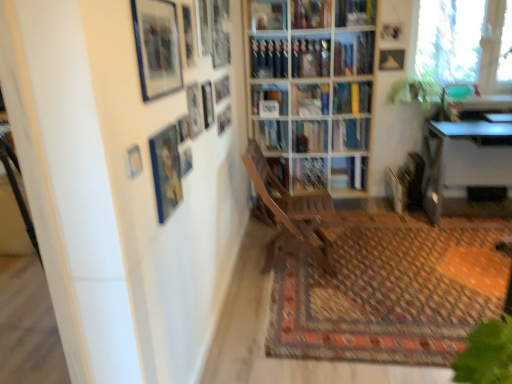
The image size is (512, 384). Describe the element at coordinates (184, 128) in the screenshot. I see `matte black picture frame at upper center, placed as the fourth picture frame when sorted from left to right` at that location.

The height and width of the screenshot is (384, 512). Describe the element at coordinates (204, 26) in the screenshot. I see `matte black picture frame at upper center, arranged as the fourth picture frame when viewed from the right` at that location.

The width and height of the screenshot is (512, 384). What do you see at coordinates (311, 92) in the screenshot? I see `wooden bookcase at center` at bounding box center [311, 92].

The height and width of the screenshot is (384, 512). Describe the element at coordinates (207, 104) in the screenshot. I see `metallic silver picture frame at upper center, which appears as the 3th picture frame when viewed from the right` at that location.

Identify the location of metallic silver picture frame at upper center, positioned as the ninth picture frame in front-to-back order. The image size is (512, 384). (207, 104).

This screenshot has height=384, width=512. Describe the element at coordinates (390, 290) in the screenshot. I see `patterned carpet at center` at that location.

Image resolution: width=512 pixels, height=384 pixels. Find the location of `matte black picture frame at upper right, the 11th picture frame from the front`. matte black picture frame at upper right, the 11th picture frame from the front is located at coordinates (391, 60).

Where is `matte black picture frame at upper center, which is the 6th picture frame in left-to-right order`? The height and width of the screenshot is (384, 512). matte black picture frame at upper center, which is the 6th picture frame in left-to-right order is located at coordinates (188, 35).

The image size is (512, 384). What do you see at coordinates (188, 35) in the screenshot?
I see `matte black picture frame at upper center, the 6th picture frame positioned from the right` at bounding box center [188, 35].

Locate an element on the screen. Image resolution: width=512 pixels, height=384 pixels. transparent glass window at upper right is located at coordinates (462, 42).

Based on the photo, considering the positions of objects transparent glass window at upper right and hardcover book at upper center, the 1th book viewed from the top, in the image provided, who is more to the right, transparent glass window at upper right or hardcover book at upper center, the 1th book viewed from the top,?

transparent glass window at upper right is more to the right.

Who is smaller, transparent glass window at upper right or hardcover book at upper center, the 1th book viewed from the top?

hardcover book at upper center, the 1th book viewed from the top, is smaller.

How much distance is there between transparent glass window at upper right and hardcover book at upper center, the 1th book viewed from the top?

The distance of transparent glass window at upper right from hardcover book at upper center, the 1th book viewed from the top, is 29.51 inches.

Are transparent glass window at upper right and hardcover book at upper center, the 1th book viewed from the top, located far from each other?

That's not correct — transparent glass window at upper right is a little close to hardcover book at upper center, the 1th book viewed from the top.

Does matte black picture frame at upper center, the 4th picture frame in the back-to-front sequence, appear on the left side of patterned carpet at center?

Correct, you'll find matte black picture frame at upper center, the 4th picture frame in the back-to-front sequence, to the left of patterned carpet at center.

Is matte black picture frame at upper center, arranged as the fourth picture frame when viewed from the right, spatially inside patterned carpet at center, or outside of it?

The correct answer is: outside.

In order to click on picture frame that is the 3rd object to the left of the patterned carpet at center, starting at the anchor in this screenshot , I will do `click(204, 26)`.

From the image's perspective, is matte black picture frame at upper center, the eighth picture frame from the front, on patterned carpet at center?

Yes.

Are matte black picture frame at upper center, arranged as the fifth picture frame when viewed from the back, and blue glossy picture frame at upper left, the second picture frame positioned from the front, located far from each other?

They are positioned close to each other.

How many degrees apart are the facing directions of matte black picture frame at upper center, the fifth picture frame in the right-to-left sequence, and blue glossy picture frame at upper left, the tenth picture frame when ordered from right to left?

The angular difference between matte black picture frame at upper center, the fifth picture frame in the right-to-left sequence, and blue glossy picture frame at upper left, the tenth picture frame when ordered from right to left, is 0.312 degrees.

Could blue glossy picture frame at upper left, the second picture frame positioned from the front, be considered to be inside matte black picture frame at upper center, the 7th picture frame in the front-to-back sequence?

That's incorrect, blue glossy picture frame at upper left, the second picture frame positioned from the front, is not inside matte black picture frame at upper center, the 7th picture frame in the front-to-back sequence.

Between point (202, 127) and point (155, 64), which one is positioned behind?

The point (202, 127) is behind.

Between matte black picture frame at upper center, acting as the fourth picture frame starting from the front, and green leafy plant at upper right, which one has larger size?

green leafy plant at upper right.

From a real-world perspective, does matte black picture frame at upper center, placed as the fourth picture frame when sorted from left to right, stand above green leafy plant at upper right?

Indeed, from a real-world perspective, matte black picture frame at upper center, placed as the fourth picture frame when sorted from left to right, stands above green leafy plant at upper right.

Is green leafy plant at upper right located within matte black picture frame at upper center, acting as the fourth picture frame starting from the front?

No, green leafy plant at upper right is not surrounded by matte black picture frame at upper center, acting as the fourth picture frame starting from the front.

In the image, is hardcover book at center, which is the third book in top-to-bottom order, on the left side or the right side of matte black picture frame at upper center, arranged as the 2th picture frame when viewed from the right?

From the image, it's evident that hardcover book at center, which is the third book in top-to-bottom order, is to the right of matte black picture frame at upper center, arranged as the 2th picture frame when viewed from the right.

Could you tell me if hardcover book at center, the 2th book positioned from the bottom, is turned towards matte black picture frame at upper center, arranged as the 2th picture frame when viewed from the right?

No, hardcover book at center, the 2th book positioned from the bottom, is not facing towards matte black picture frame at upper center, arranged as the 2th picture frame when viewed from the right.

Can you confirm if hardcover book at center, which is the third book in top-to-bottom order, is bigger than matte black picture frame at upper center, which is the tenth picture frame in front-to-back order?

Correct, hardcover book at center, which is the third book in top-to-bottom order, is larger in size than matte black picture frame at upper center, which is the tenth picture frame in front-to-back order.

Is hardcover book at center, the 2th book positioned from the bottom, inside the boundaries of matte black picture frame at upper center, positioned as the tenth picture frame in left-to-right order, or outside?

hardcover book at center, the 2th book positioned from the bottom, exists outside the volume of matte black picture frame at upper center, positioned as the tenth picture frame in left-to-right order.

Is the surface of hardcover book at upper center, the 4th book in the bottom-to-top sequence, in direct contact with hardcover book at upper center, positioned as the 3th book in bottom-to-top order?

They are not placed beside each other.

From a real-world perspective, which is physically below, hardcover book at upper center, the 4th book in the bottom-to-top sequence, or hardcover book at upper center, positioned as the 3th book in bottom-to-top order?

hardcover book at upper center, positioned as the 3th book in bottom-to-top order, is physically lower.

Considering the relative positions of hardcover book at upper center, the 1th book viewed from the top, and hardcover book at upper center, positioned as the 3th book in bottom-to-top order, in the image provided, is hardcover book at upper center, the 1th book viewed from the top, behind hardcover book at upper center, positioned as the 3th book in bottom-to-top order,?

No, it is in front of hardcover book at upper center, positioned as the 3th book in bottom-to-top order.

Is wooden bookcase at center behind metallic silver picture frame at upper left, which ranks as the first picture frame in front-to-back order?

Yes, it is.

Do you think wooden bookcase at center is within metallic silver picture frame at upper left, which appears as the 11th picture frame when viewed from the right, or outside of it?

wooden bookcase at center is located beyond the bounds of metallic silver picture frame at upper left, which appears as the 11th picture frame when viewed from the right.

From a real-world perspective, is wooden bookcase at center beneath metallic silver picture frame at upper left, which ranks as the first picture frame in front-to-back order?

Correct, in the physical world, wooden bookcase at center is lower than metallic silver picture frame at upper left, which ranks as the first picture frame in front-to-back order.

Considering the positions of objects wooden bookcase at center and metallic silver picture frame at upper left, which ranks as the eleventh picture frame in back-to-front order, in the image provided, who is more to the left, wooden bookcase at center or metallic silver picture frame at upper left, which ranks as the eleventh picture frame in back-to-front order,?

metallic silver picture frame at upper left, which ranks as the eleventh picture frame in back-to-front order.

This screenshot has width=512, height=384. Find the location of `window below the hardcover book at upper center, the 1th book viewed from the top (from the image's perspective)`. window below the hardcover book at upper center, the 1th book viewed from the top (from the image's perspective) is located at coordinates (462, 42).

Locate an element on the screen. This screenshot has height=384, width=512. mat that is under the matte black picture frame at upper center, marked as the eighth picture frame in a left-to-right arrangement (from a real-world perspective) is located at coordinates (390, 290).

Which object lies nearer to the anchor point hardcover book at upper center, the second book viewed from the top, matte black picture frame at upper center, the 2th picture frame in the back-to-front sequence, or green leafy plant at upper right?

Based on the image, green leafy plant at upper right appears to be nearer to hardcover book at upper center, the second book viewed from the top.

When comparing their distances from green leafy plant at upper right, does wooden bookcase at center or matte black picture frame at upper center, arranged as the fourth picture frame when viewed from the right, seem closer?

wooden bookcase at center.

Considering their positions, is matte wooden picture frame at upper left, which is the ninth picture frame in right-to-left order, positioned further to metallic silver desk at right than matte black picture frame at upper center, which is the sixth picture frame from front to back?

matte wooden picture frame at upper left, which is the ninth picture frame in right-to-left order, is further to metallic silver desk at right.

Considering their positions, is transparent glass window at upper right positioned further to hardcover book at center, which is the third book in top-to-bottom order, than metallic silver picture frame at upper left, which appears as the 11th picture frame when viewed from the right?

metallic silver picture frame at upper left, which appears as the 11th picture frame when viewed from the right, is further to hardcover book at center, which is the third book in top-to-bottom order.

Which object lies nearer to the anchor point matte black picture frame at upper center, the 4th picture frame in the back-to-front sequence, wooden bookcase at center or metallic silver picture frame at upper left, which appears as the 11th picture frame when viewed from the right?

metallic silver picture frame at upper left, which appears as the 11th picture frame when viewed from the right, lies closer to matte black picture frame at upper center, the 4th picture frame in the back-to-front sequence, than the other object.

Estimate the real-world distances between objects in this image. Which object is closer to metallic silver picture frame at upper center, the 9th picture frame positioned from the left, blue hardcover book at center, which is the 4th book from top to bottom, or hardcover book at upper center, the 1th book viewed from the top?

blue hardcover book at center, which is the 4th book from top to bottom.

From the image, which object appears to be farther from matte black picture frame at upper center, the seventh picture frame positioned from the left, blue hardcover book at center, which is the 4th book from top to bottom, or wooden bookcase at center?

blue hardcover book at center, which is the 4th book from top to bottom, is positioned further to the anchor matte black picture frame at upper center, the seventh picture frame positioned from the left.

From the image, which object appears to be farther from matte black picture frame at upper center, the 7th picture frame from the back, hardcover book at upper center, the second book viewed from the top, or matte black picture frame at upper center, positioned as the 8th picture frame in back-to-front order?

Among the two, hardcover book at upper center, the second book viewed from the top, is located further to matte black picture frame at upper center, the 7th picture frame from the back.

The width and height of the screenshot is (512, 384). Find the location of `mat located between blue glossy picture frame at upper left, which appears as the tenth picture frame when viewed from the back, and matte black picture frame at upper right, the 11th picture frame from the front, in the depth direction`. mat located between blue glossy picture frame at upper left, which appears as the tenth picture frame when viewed from the back, and matte black picture frame at upper right, the 11th picture frame from the front, in the depth direction is located at coordinates (390, 290).

Find the location of a particular element. chair between matte black picture frame at upper center, acting as the fourth picture frame starting from the front, and wooden bookcase at center in the front-back direction is located at coordinates (293, 208).

Locate an element on the screen. Image resolution: width=512 pixels, height=384 pixels. bookcase between matte black picture frame at upper center, which is the 6th picture frame in left-to-right order, and hardcover book at upper center, the 4th book in the bottom-to-top sequence, in the front-back direction is located at coordinates (311, 92).

The height and width of the screenshot is (384, 512). Find the location of `window positioned between metallic silver picture frame at upper left, which ranks as the eleventh picture frame in back-to-front order, and hardcover book at center, which is the third book in top-to-bottom order, from near to far`. window positioned between metallic silver picture frame at upper left, which ranks as the eleventh picture frame in back-to-front order, and hardcover book at center, which is the third book in top-to-bottom order, from near to far is located at coordinates (462, 42).